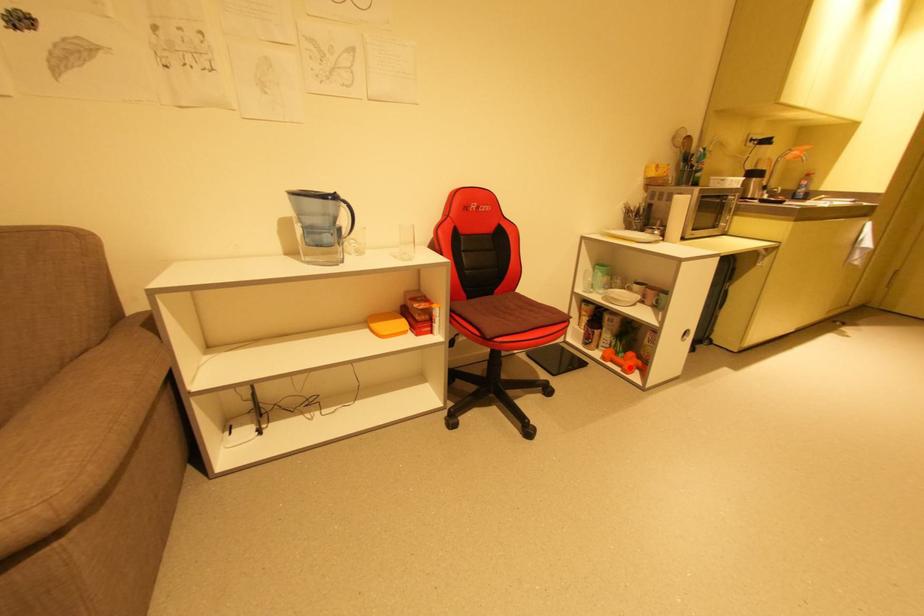
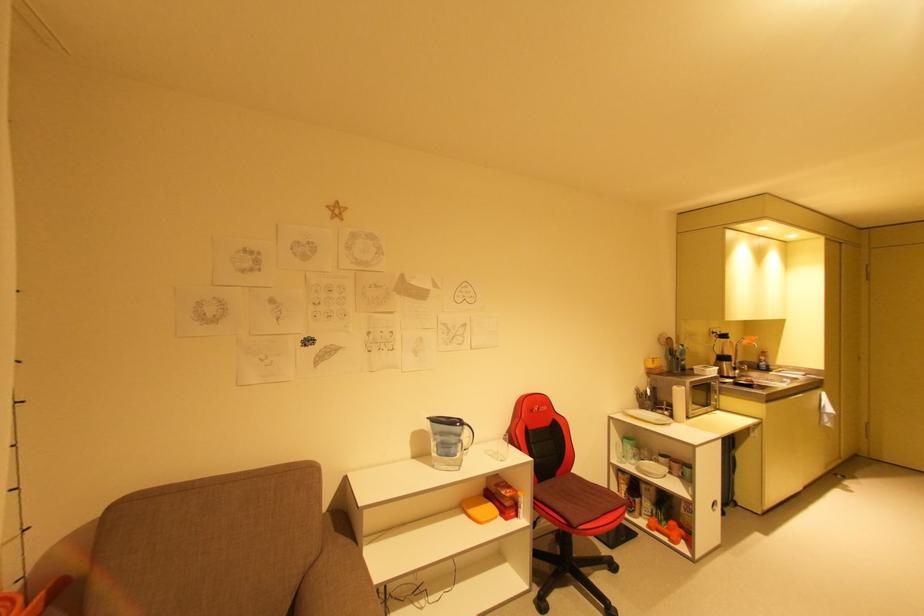
Question: I am providing you with two images of the same scene from different viewpoints. In image1, a red point is highlighted. Considering the same 3D point in image2, which of the following is correct?

Choices:
 (A) It is closer
 (B) It is farther

Answer: (B)